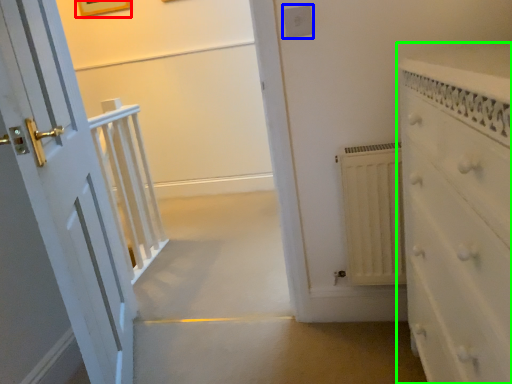
Question: Based on their relative distances, which object is nearer to picture frame (highlighted by a red box)? Choose from electric outlet (highlighted by a blue box) and chest of drawers (highlighted by a green box).

Choices:
 (A) electric outlet
 (B) chest of drawers

Answer: (A)